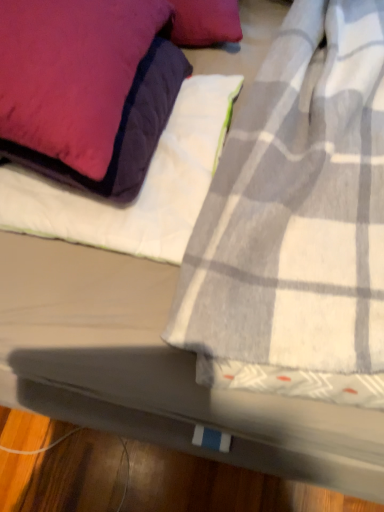
Question: From a real-world perspective, is velvet purple pillow at upper left positioned under white quilted sheet at upper left based on gravity?

Choices:
 (A) no
 (B) yes

Answer: (A)

Question: Can you confirm if velvet purple pillow at upper left is shorter than white quilted sheet at upper left?

Choices:
 (A) no
 (B) yes

Answer: (A)

Question: From the image's perspective, is velvet purple pillow at upper left below white quilted sheet at upper left?

Choices:
 (A) yes
 (B) no

Answer: (B)

Question: Is velvet purple pillow at upper left thinner than white quilted sheet at upper left?

Choices:
 (A) no
 (B) yes

Answer: (A)

Question: Is velvet purple pillow at upper left far from white quilted sheet at upper left?

Choices:
 (A) yes
 (B) no

Answer: (B)

Question: Does velvet purple pillow at upper left have a greater width compared to white quilted sheet at upper left?

Choices:
 (A) no
 (B) yes

Answer: (B)

Question: Is velvet purple pillow at upper left completely or partially inside white quilted sheet at upper left?

Choices:
 (A) yes
 (B) no

Answer: (B)

Question: Can we say white quilted sheet at upper left lies outside velvet purple pillow at upper left?

Choices:
 (A) yes
 (B) no

Answer: (A)

Question: Is white quilted sheet at upper left to the left of velvet purple pillow at upper left from the viewer's perspective?

Choices:
 (A) yes
 (B) no

Answer: (B)

Question: Is the depth of white quilted sheet at upper left greater than that of velvet purple pillow at upper left?

Choices:
 (A) no
 (B) yes

Answer: (B)

Question: From a real-world perspective, is white quilted sheet at upper left on velvet purple pillow at upper left?

Choices:
 (A) yes
 (B) no

Answer: (B)

Question: Is white quilted sheet at upper left oriented towards velvet purple pillow at upper left?

Choices:
 (A) no
 (B) yes

Answer: (A)

Question: Is velvet purple pillow at upper left in front of or behind white quilted sheet at upper left in the image?

Choices:
 (A) behind
 (B) front

Answer: (B)